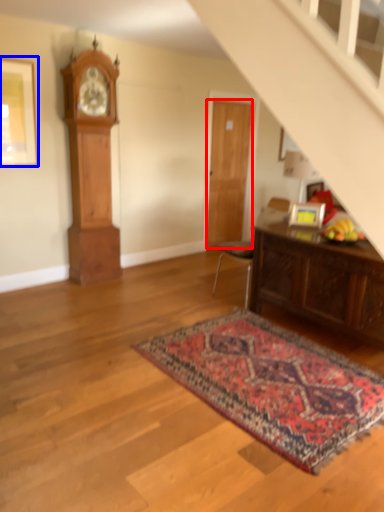
Question: Which of the following is the closest to the observer, door (highlighted by a red box) or picture frame (highlighted by a blue box)?

Choices:
 (A) door
 (B) picture frame

Answer: (B)